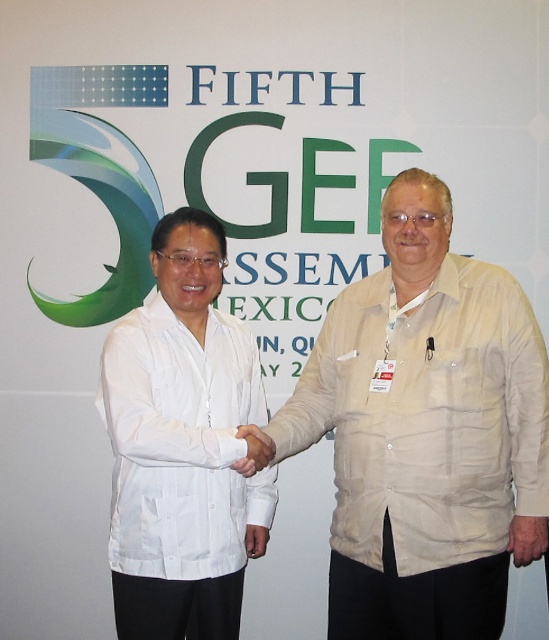
Question: Can you confirm if beige fabric shirt at center is smaller than white matte shirt at center?

Choices:
 (A) yes
 (B) no

Answer: (B)

Question: Is beige fabric shirt at center thinner than white matte shirt at center?

Choices:
 (A) no
 (B) yes

Answer: (A)

Question: Is beige fabric shirt at center smaller than white matte shirt at center?

Choices:
 (A) yes
 (B) no

Answer: (B)